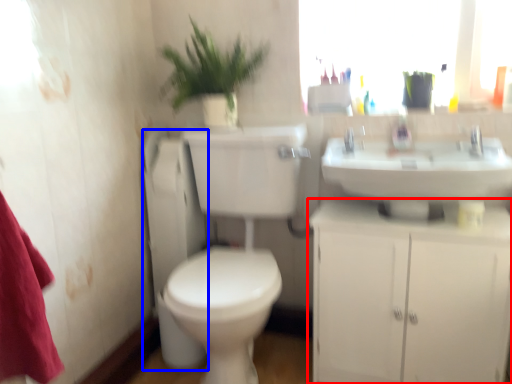
Question: Which object is further to the camera taking this photo, bathroom cabinet (highlighted by a red box) or appliance (highlighted by a blue box)?

Choices:
 (A) bathroom cabinet
 (B) appliance

Answer: (B)